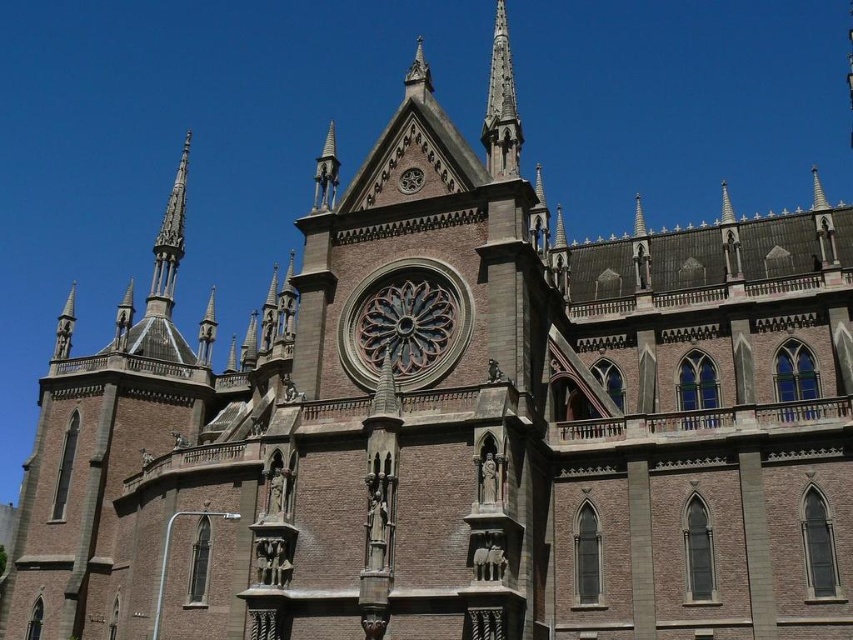
You are an architect analyzing the church facade. You notice the smooth stone spire at upper center and the carved stone spire at upper left. Which spire is taller?

The smooth stone spire at upper center is much taller than the carved stone spire at upper left according to the description.

From the picture: You are standing in front of the Gothic church and want to take a photo focusing on the smooth stone spire at upper center and the carved stone spire at upper left. Which spire will appear larger in your photo?

The smooth stone spire at upper center will appear larger in the photo because it is closer to the viewer than the carved stone spire at upper left.

You are standing in front of the grand Gothic church. There is a point marked at coordinates (502, 106). Based on the description, what architectural feature does this point most likely represent?

The point at coordinates (502, 106) most likely represents the smooth stone spire at upper center.